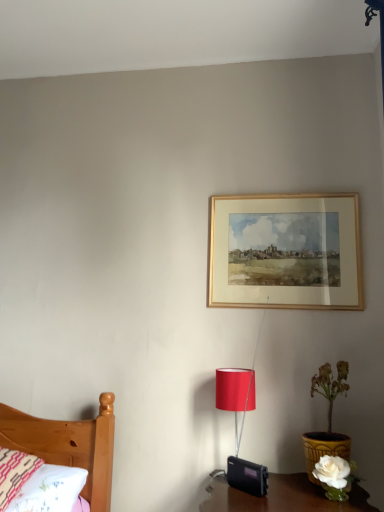
Question: From the image's perspective, is gold wooden picture frame at upper center located beneath embroidered cotton pillow at lower left?

Choices:
 (A) yes
 (B) no

Answer: (B)

Question: Is the depth of gold wooden picture frame at upper center less than that of embroidered cotton pillow at lower left?

Choices:
 (A) yes
 (B) no

Answer: (B)

Question: From a real-world perspective, is gold wooden picture frame at upper center physically above embroidered cotton pillow at lower left?

Choices:
 (A) yes
 (B) no

Answer: (A)

Question: Is gold wooden picture frame at upper center wider than embroidered cotton pillow at lower left?

Choices:
 (A) yes
 (B) no

Answer: (B)

Question: Is gold wooden picture frame at upper center positioned with its back to embroidered cotton pillow at lower left?

Choices:
 (A) yes
 (B) no

Answer: (B)

Question: Is gold wooden picture frame at upper center wider or thinner than matte red lampshade at lower center?

Choices:
 (A) thin
 (B) wide

Answer: (A)

Question: Is gold wooden picture frame at upper center to the left or to the right of matte red lampshade at lower center in the image?

Choices:
 (A) right
 (B) left

Answer: (A)

Question: Is gold wooden picture frame at upper center situated inside matte red lampshade at lower center or outside?

Choices:
 (A) outside
 (B) inside

Answer: (A)

Question: In terms of height, does gold wooden picture frame at upper center look taller or shorter compared to matte red lampshade at lower center?

Choices:
 (A) short
 (B) tall

Answer: (B)

Question: Does point (38, 506) appear closer or farther from the camera than point (243, 201)?

Choices:
 (A) closer
 (B) farther

Answer: (A)

Question: Looking at their shapes, would you say embroidered cotton pillow at lower left is wider or thinner than gold wooden picture frame at upper center?

Choices:
 (A) thin
 (B) wide

Answer: (B)

Question: Based on their sizes in the image, would you say embroidered cotton pillow at lower left is bigger or smaller than gold wooden picture frame at upper center?

Choices:
 (A) big
 (B) small

Answer: (A)

Question: From the image's perspective, is embroidered cotton pillow at lower left located above or below gold wooden picture frame at upper center?

Choices:
 (A) below
 (B) above

Answer: (A)

Question: Considering the positions of point (241, 400) and point (306, 471), is point (241, 400) closer or farther from the camera than point (306, 471)?

Choices:
 (A) farther
 (B) closer

Answer: (B)

Question: From a real-world perspective, is matte red lampshade at lower center above or below white ceramic vase at lower right?

Choices:
 (A) above
 (B) below

Answer: (B)